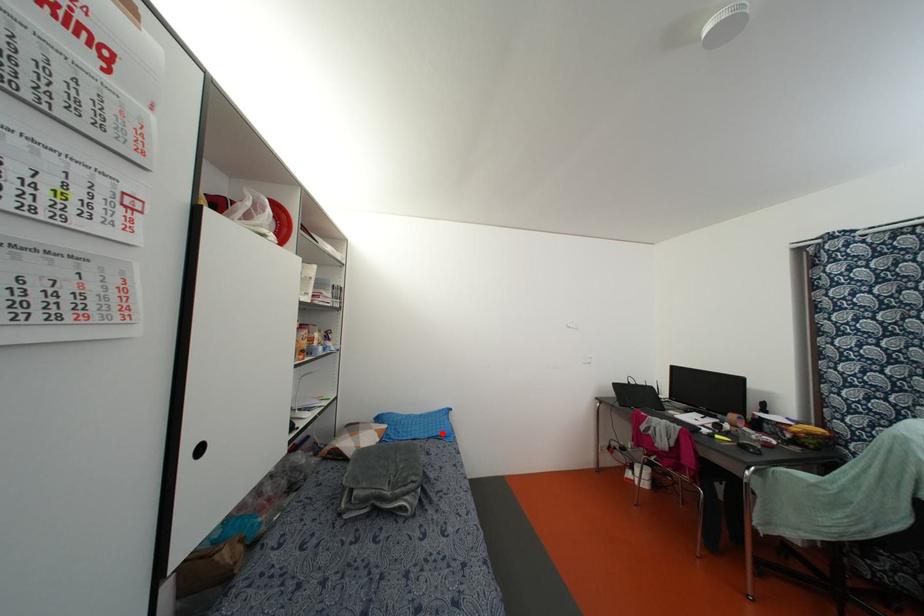
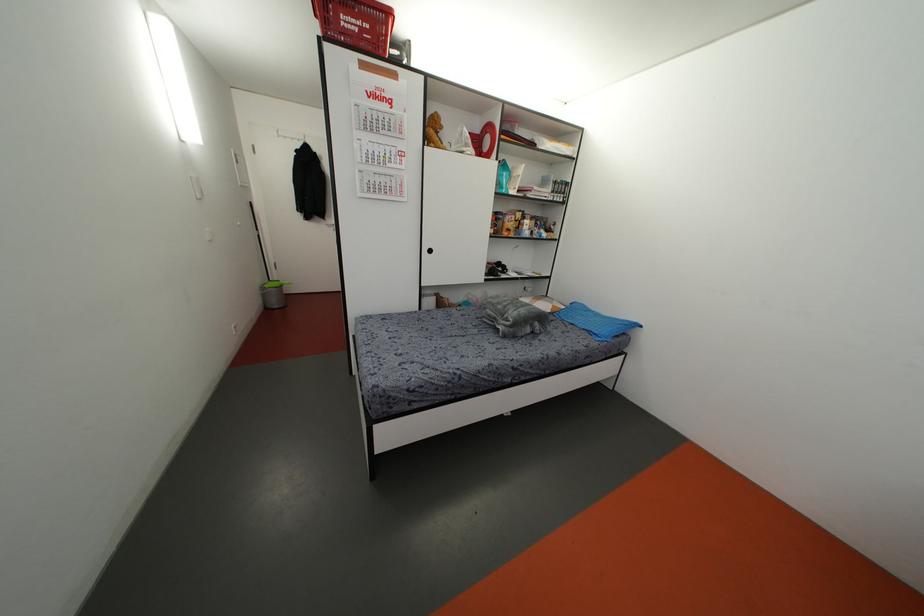
Question: I am providing you with two images of the same scene from different viewpoints. In image1, a red point is highlighted. Considering the same 3D point in image2, which of the following is correct?

Choices:
 (A) It is closer
 (B) It is farther

Answer: (A)